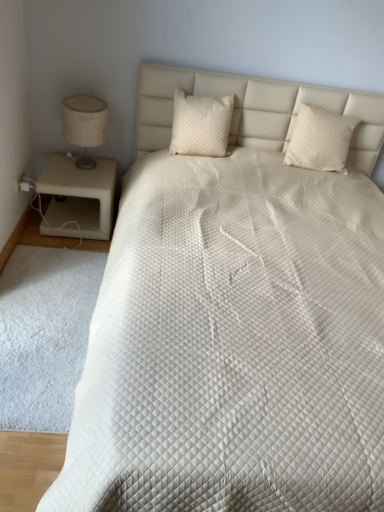
This screenshot has height=512, width=384. Identify the location of vacant space in beige fabric lampshade at left (from a real-world perspective). (87, 163).